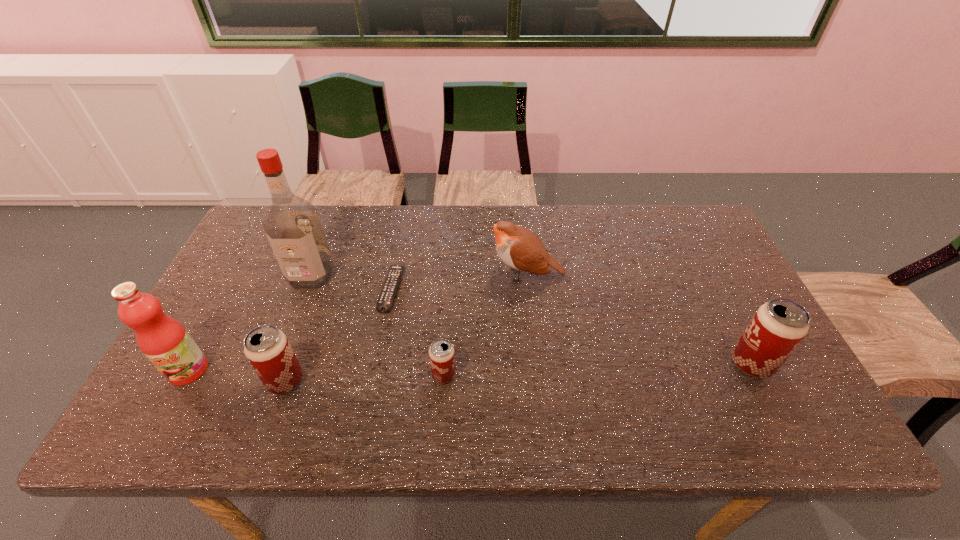
If we want them evenly spaced by inserting an extra beer_can among them, please locate a free spot for this new beer_can. Please provide its 2D coordinates. Your answer should be formatted as a tuple, i.e. [(x, y)], where the tuple contains the x and y coordinates of a point satisfying the conditions above.

[(599, 369)]